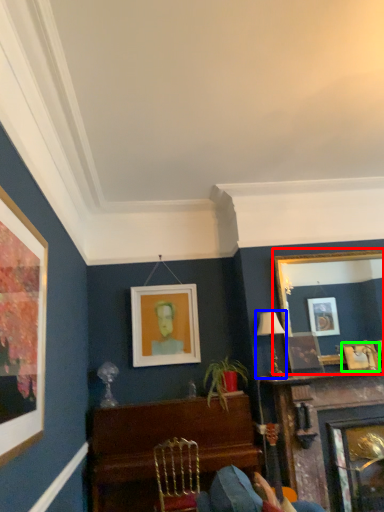
Question: Based on their relative distances, which object is farther from picture frame (highlighted by a red box)? Choose from lamp (highlighted by a blue box) and picture frame (highlighted by a green box).

Choices:
 (A) lamp
 (B) picture frame

Answer: (A)